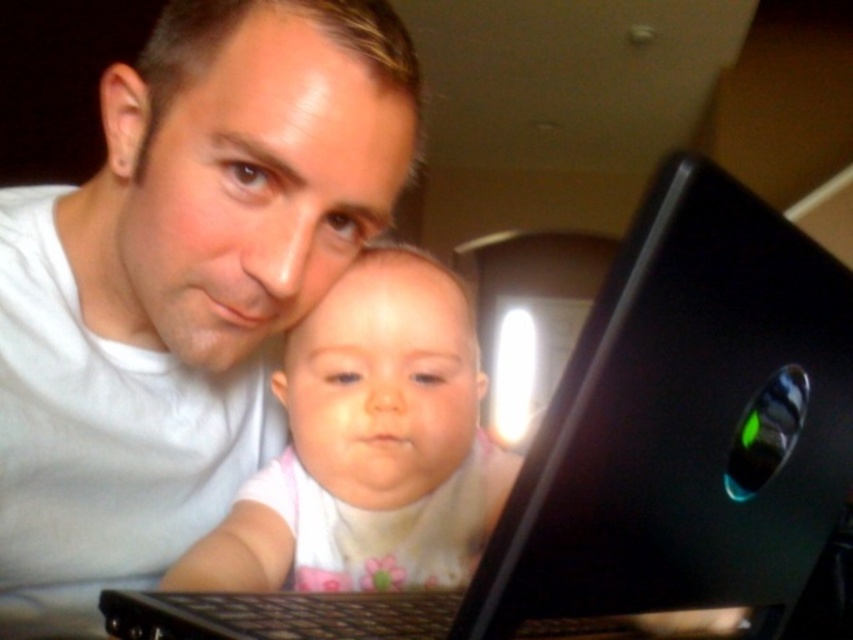
Question: Among these points, which one is nearest to the camera?

Choices:
 (A) (786, 548)
 (B) (242, 513)
 (C) (51, 486)

Answer: (A)

Question: Which point is closer to the camera?

Choices:
 (A) (662, 212)
 (B) (270, 566)

Answer: (A)

Question: Does white matte shirt at center appear on the left side of black glossy laptop at center?

Choices:
 (A) yes
 (B) no

Answer: (A)

Question: Does white matte shirt at center appear on the left side of smooth white baby at center?

Choices:
 (A) no
 (B) yes

Answer: (B)

Question: Which point is farther from the camera taking this photo?

Choices:
 (A) (157, 109)
 (B) (525, 541)
 (C) (387, 513)

Answer: (C)

Question: Can you confirm if white matte shirt at center is positioned above smooth white baby at center?

Choices:
 (A) yes
 (B) no

Answer: (A)